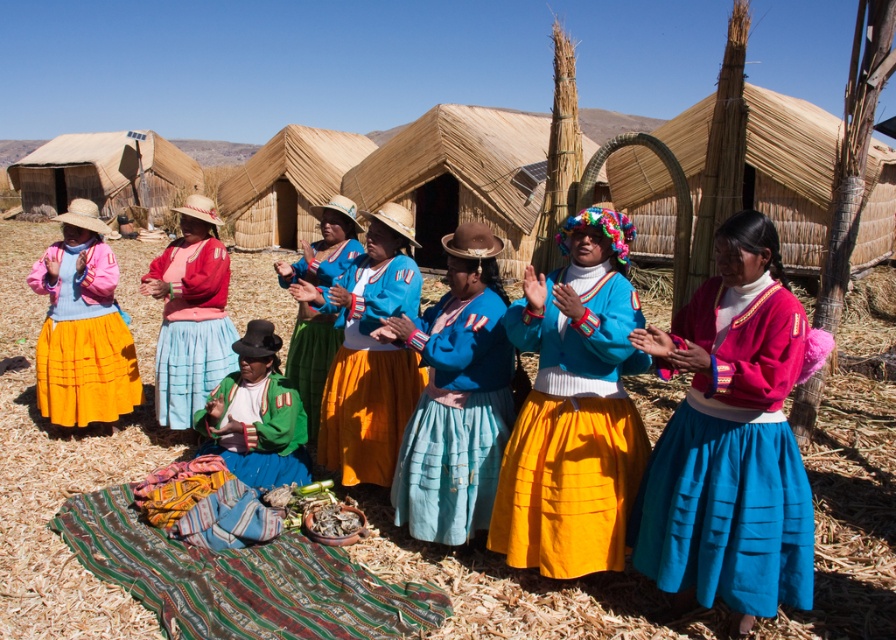
Question: In this image, where is multicolored woven cloth at lower center located relative to blue cotton skirt at center?

Choices:
 (A) below
 (B) above

Answer: (A)

Question: Can you confirm if blue cotton skirt at center is wider than matte yellow skirt at left?

Choices:
 (A) no
 (B) yes

Answer: (A)

Question: Which object is positioned closest to the matte blue skirt at center?

Choices:
 (A) matte blue sweater at center
 (B) blue cotton blouse at center
 (C) matte pink sweater at center

Answer: (B)

Question: Does matte blue sweater at center appear on the right side of green fabric at center?

Choices:
 (A) no
 (B) yes

Answer: (B)

Question: Which point is farther to the camera?

Choices:
 (A) (210, 525)
 (B) (748, 611)
 (C) (308, 410)
 (D) (194, 328)

Answer: (D)

Question: Which of these objects is positioned closest to the green fabric at center?

Choices:
 (A) matte yellow skirt at left
 (B) matte blue sweater at center

Answer: (B)